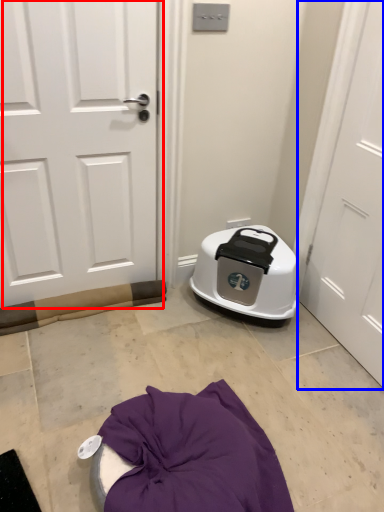
Question: Which of the following is the closest to the observer, door (highlighted by a red box) or door (highlighted by a blue box)?

Choices:
 (A) door
 (B) door

Answer: (B)